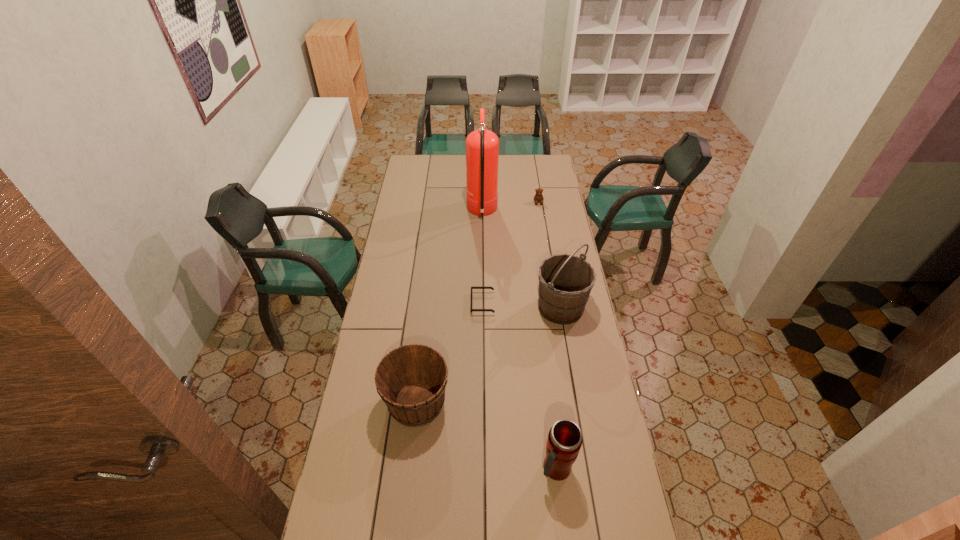
Locate an element on the screen. The width and height of the screenshot is (960, 540). vacant point located between the fire extinguisher and the fifth farthest object is located at coordinates (449, 307).

Locate an element on the screen. This screenshot has width=960, height=540. vacant area that lies between the thermos bottle and the shortest object is located at coordinates (519, 386).

This screenshot has height=540, width=960. I want to click on free point between the sunglasses and the fourth tallest object, so click(x=449, y=353).

Where is `free space between the fifth farthest object and the fire extinguisher`? Image resolution: width=960 pixels, height=540 pixels. free space between the fifth farthest object and the fire extinguisher is located at coordinates (449, 307).

This screenshot has width=960, height=540. Identify the location of free spot between the fifth shortest object and the fourth shortest object. (559, 388).

Identify the location of object that can be found as the closest to the nearest object. (411, 380).

At what (x,y) coordinates should I click in order to perform the action: click on object that is the second nearest to the teddy bear. Please return your answer as a coordinate pair (x, y). This screenshot has height=540, width=960. Looking at the image, I should click on (565, 281).

Find the location of `free location that satisfies the following two spatial constraints: 1. on the front-facing side of the shortest object; 2. on the left side of the fifth shortest object`. free location that satisfies the following two spatial constraints: 1. on the front-facing side of the shortest object; 2. on the left side of the fifth shortest object is located at coordinates [483, 307].

Identify the location of vacant area that satisfies the following two spatial constraints: 1. on the face of the second shortest object; 2. on the front-facing side of the sunglasses. This screenshot has width=960, height=540. (554, 303).

Image resolution: width=960 pixels, height=540 pixels. In order to click on vacant area that satisfies the following two spatial constraints: 1. on the face of the teddy bear; 2. towards the nozzle of the tallest object in this screenshot , I will do `click(540, 212)`.